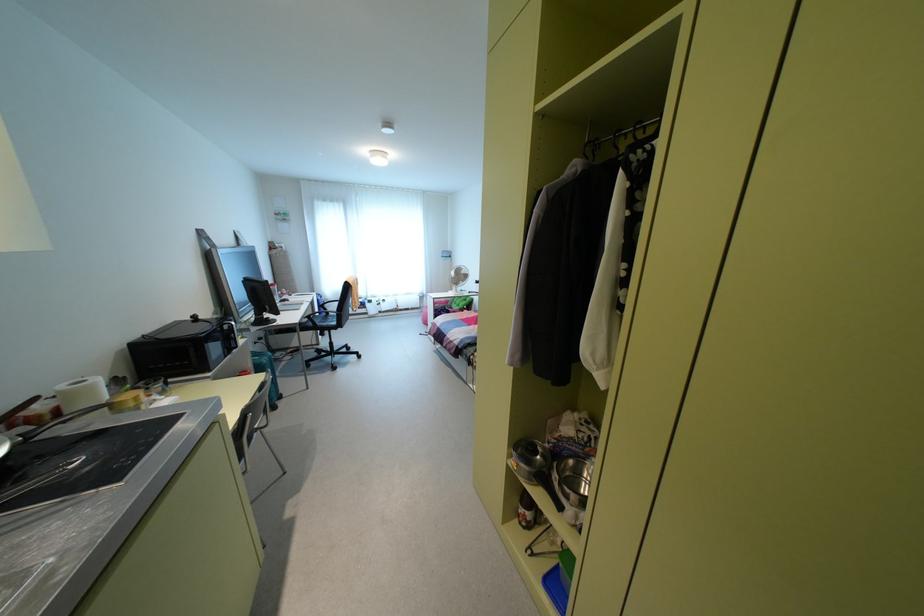
Describe the element at coordinates (555, 588) in the screenshot. I see `the blue plastic container` at that location.